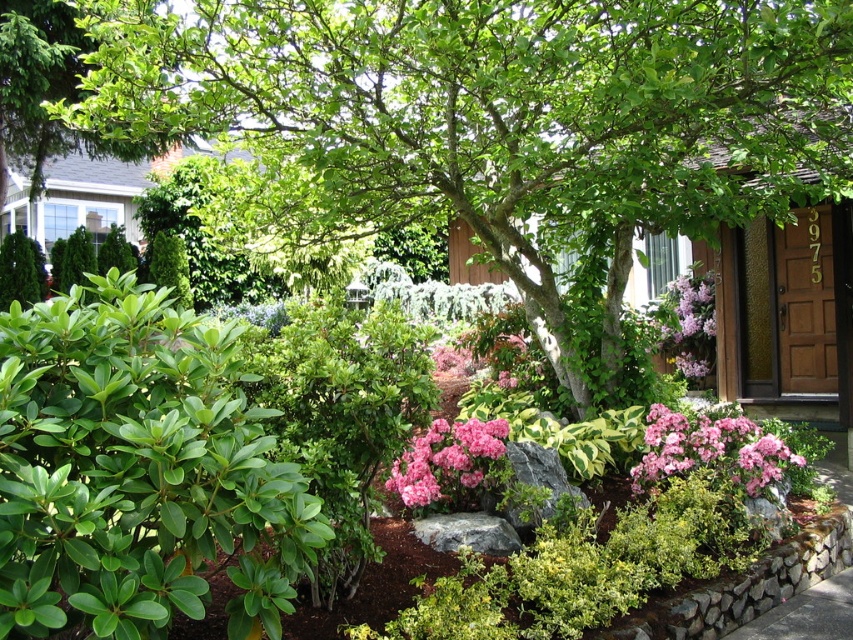
Looking at this image, you are standing in the garden and want to take a photo of both the green leafy tree at center and the pink matte flower at center. Which object should you position closer to the left side of your camera frame to include both in the photo?

To include both the green leafy tree at center and the pink matte flower at center in the photo, you should position the pink matte flower at center closer to the left side of your camera frame since the green leafy tree at center is on its right side.

You are standing in the garden and want to locate the pink matte flower at center. According to the coordinates provided, where should you look?

The pink matte flower at center is located at point coordinates (450,465).